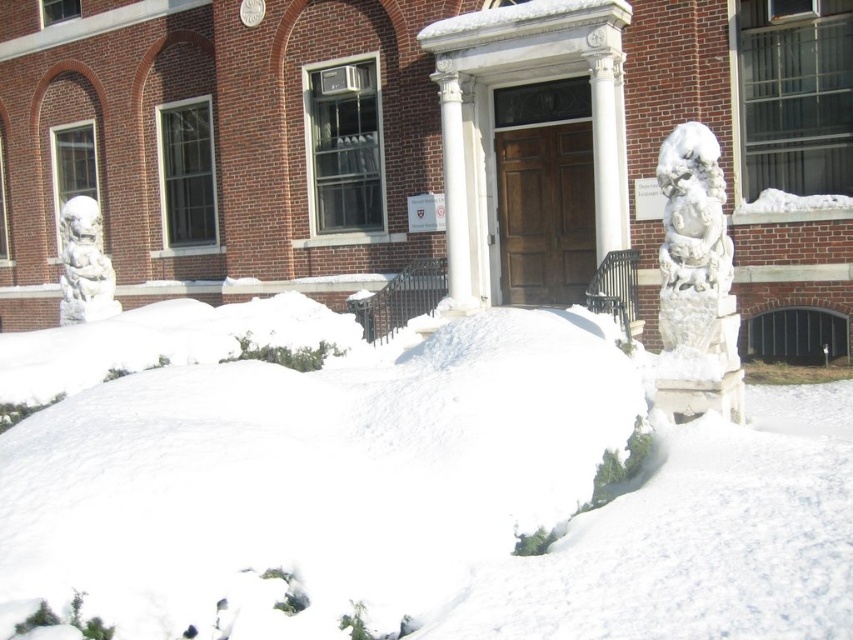
Question: Which of these objects is positioned farthest from the white marble column at center?

Choices:
 (A) white stone lion at left
 (B) white marble lion at right

Answer: (A)

Question: Is white marble columns at center smaller than white marble column at center?

Choices:
 (A) yes
 (B) no

Answer: (B)

Question: Which of the following is the farthest from the observer?

Choices:
 (A) white marble columns at center
 (B) white marble column at center
 (C) white stone lion at left

Answer: (B)

Question: Is white marble lion at right thinner than white marble column at center?

Choices:
 (A) yes
 (B) no

Answer: (B)

Question: Which point is farther to the camera?

Choices:
 (A) white stone lion at left
 (B) white marble lion at right

Answer: (A)

Question: Is white marble columns at center behind white marble lion at right?

Choices:
 (A) no
 (B) yes

Answer: (B)